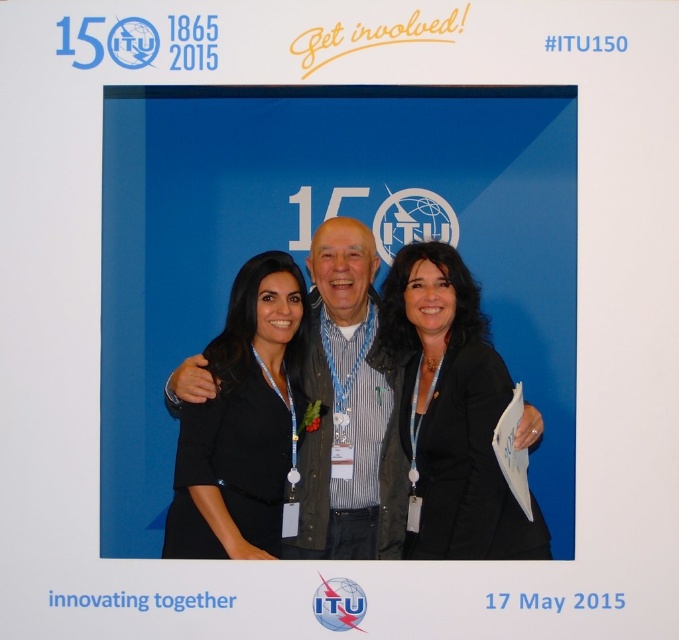
You are organizing a photo shoot for an event and need to ensure that the clothing items are appropriately sized. You have a black striped shirt at center and a black matte blazer at center in the image. Based on the description, which clothing item is larger in size?

The black striped shirt at center is larger in size compared to the black matte blazer at center according to the description.

You are organizing a photo shoot and need to ensure that the black striped shirt at center and the black fabric jacket at center are visible in the final image. Given that the camera lens can only focus on items within a 1.2 meter width, will both items fit within this width requirement?

The black striped shirt at center is wider than the black fabric jacket at center. Since the camera lens can focus on items within a 1.2 meter width, both items will fit as long as their combined width does not exceed 1.2 meters. However, the exact combined width isnanot provided, so we cannot definitively confirm if they will fit.